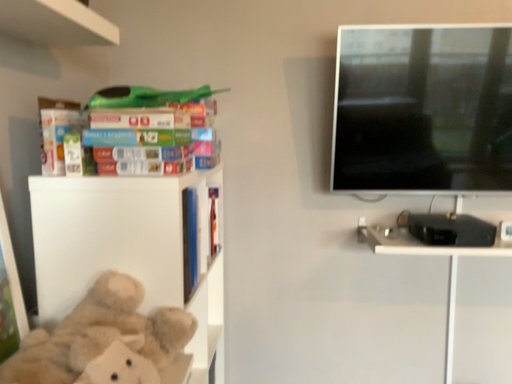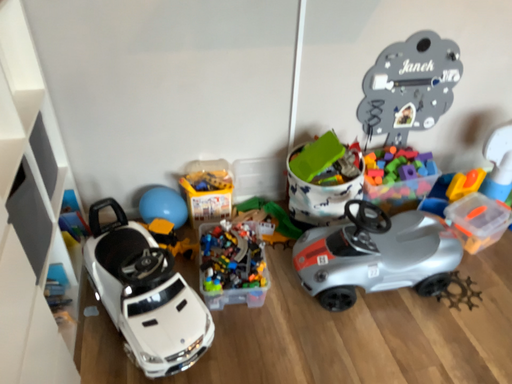
Question: How did the camera likely rotate when shooting the video?

Choices:
 (A) rotated downward
 (B) rotated upward

Answer: (A)